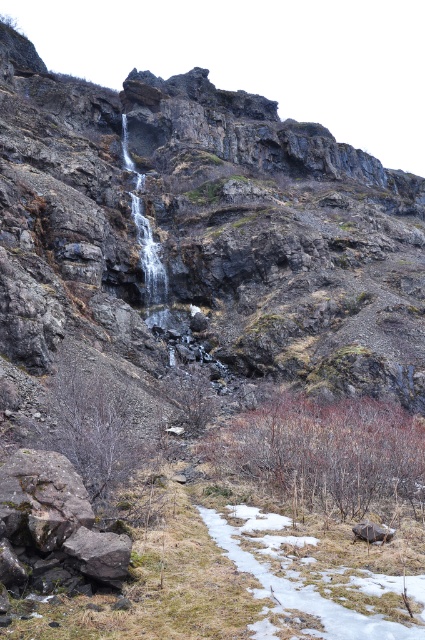
Does rusty metallic rock at lower left appear over smooth gray rock at lower right?

Correct, rusty metallic rock at lower left is located above smooth gray rock at lower right.

Is rusty metallic rock at lower left shorter than smooth gray rock at lower right?

No, rusty metallic rock at lower left is not shorter than smooth gray rock at lower right.

Is point (42, 586) closer to viewer compared to point (379, 531)?

That is True.

Locate an element on the screen. This screenshot has width=425, height=640. rusty metallic rock at lower left is located at coordinates (53, 529).